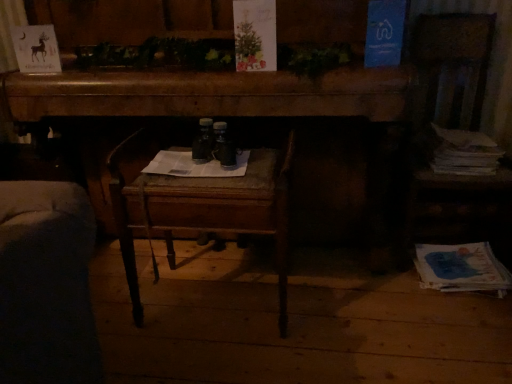
I want to click on free space that is to the left of blue paper at lower right, the 2th magazine from the top, so click(385, 288).